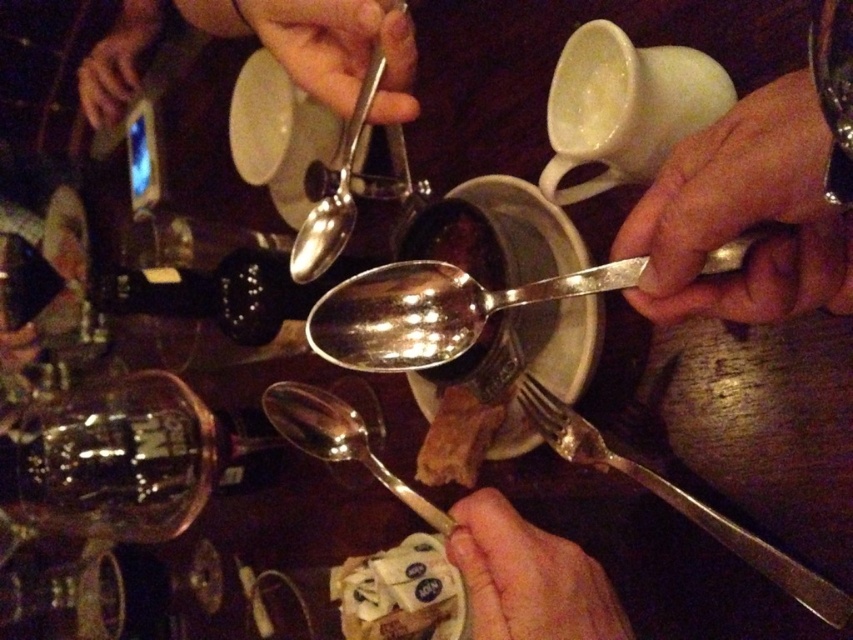
You are a waiter at the restaurant and need to retrieve the polished silver spoon at center and the shiny silver spoon at center from the table. Which spoon should you pick up first if you want to follow the standard left to right order?

The shiny silver spoon at center should be picked up first since it is to the left of the polished silver spoon at center, following the left to right order.

From the picture: You are a server at a restaurant and need to choose the wider spoon to serve the dessert. Which spoon should you pick between the polished silver spoon at center and the shiny silver spoon at center?

The polished silver spoon at center is wider than the shiny silver spoon at center, so you should pick the polished silver spoon at center.

You are a waiter at the restaurant and need to place a napkin under the shiny silver spoon at center and the smooth skin hand at upper left. Which object requires a larger napkin to fully cover it?

The smooth skin hand at upper left requires a larger napkin because it is longer than the shiny silver spoon at center.